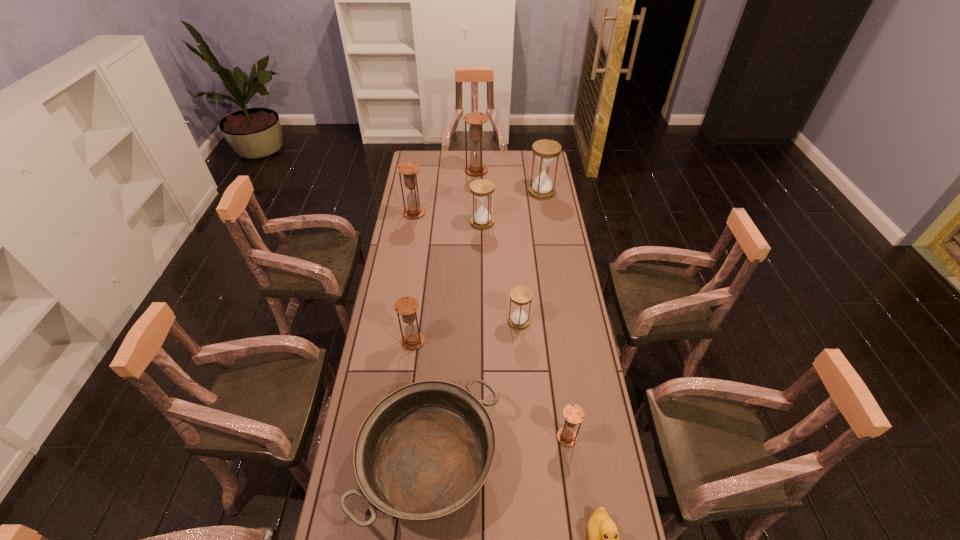
Identify the location of object located at the far edge. The height and width of the screenshot is (540, 960). (475, 120).

In order to click on free space at the left edge of the desktop in this screenshot , I will do `click(413, 231)`.

The width and height of the screenshot is (960, 540). I want to click on free region at the right edge, so click(564, 354).

The width and height of the screenshot is (960, 540). I want to click on vacant area between the second biggest brown hourglass and the smallest brown hourglass, so click(491, 325).

At what (x,y) coordinates should I click in order to perform the action: click on free point between the biggest brown hourglass and the nearest white hourglass. Please return your answer as a coordinate pair (x, y). The height and width of the screenshot is (540, 960). Looking at the image, I should click on (497, 246).

Locate an element on the screen. free space between the farthest brown hourglass and the second farthest hourglass is located at coordinates (509, 181).

Where is `vacant region between the third nearest brown hourglass and the third farthest brown hourglass`? The height and width of the screenshot is (540, 960). vacant region between the third nearest brown hourglass and the third farthest brown hourglass is located at coordinates (414, 278).

This screenshot has height=540, width=960. Identify the location of vacant space in between the tallest object and the fifth farthest hourglass. (497, 246).

The width and height of the screenshot is (960, 540). I want to click on object that is the third closest to the rightmost brown hourglass, so click(520, 295).

Select which object appears as the fourth closest to the pan. Please provide its 2D coordinates. Your answer should be formatted as a tuple, i.e. [(x, y)], where the tuple contains the x and y coordinates of a point satisfying the conditions above.

[(520, 295)]